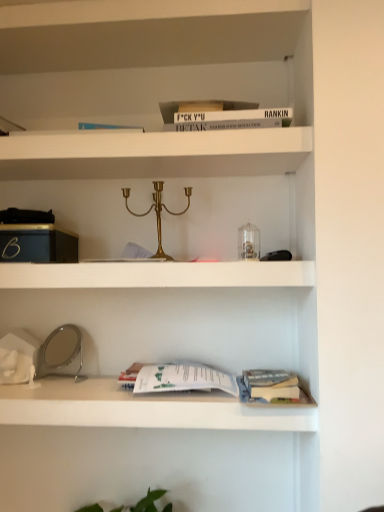
Question: Relative to white matte shelf at upper center, placed as the 1th shelf when sorted from top to bottom, is white paper at lower center, which is counted as the first shelf, starting from the bottom, in front or behind?

Choices:
 (A) front
 (B) behind

Answer: (A)

Question: Does point (226, 294) appear closer or farther from the camera than point (195, 52)?

Choices:
 (A) farther
 (B) closer

Answer: (A)

Question: Estimate the real-world distances between objects in this image. Which object is closer to the white paper at lower center, positioned as the second shelf in top-to-bottom order?

Choices:
 (A) white matte shelf at upper center, placed as the 1th shelf when sorted from top to bottom
 (B) white matte shelf at center

Answer: (B)

Question: Which is nearer to the white paper at lower center, which is counted as the first shelf, starting from the bottom?

Choices:
 (A) white matte shelf at center
 (B) white matte shelf at upper center, which is the second shelf in bottom-to-top order

Answer: (A)